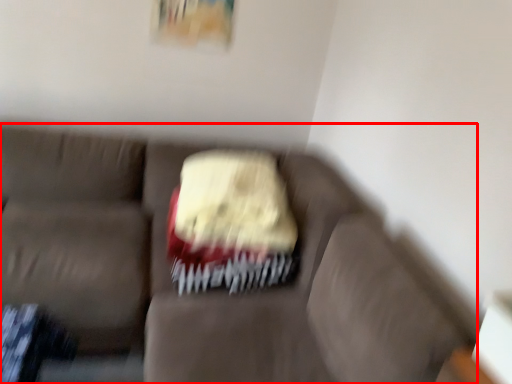
Question: Observing the image, what is the correct spatial positioning of studio couch (annotated by the red box) in reference to cake?

Choices:
 (A) left
 (B) right

Answer: (A)